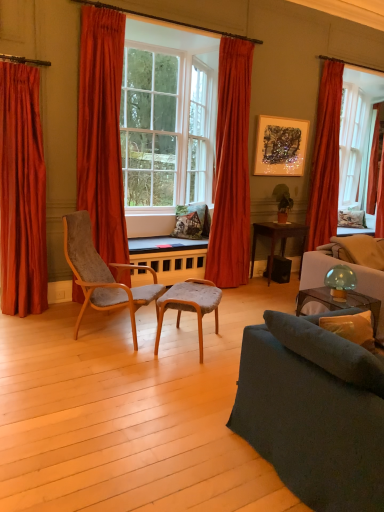
Where is `free space to the left of velvet grey chair at left, which appears as the 2th chair when viewed from the right`? free space to the left of velvet grey chair at left, which appears as the 2th chair when viewed from the right is located at coordinates (36, 331).